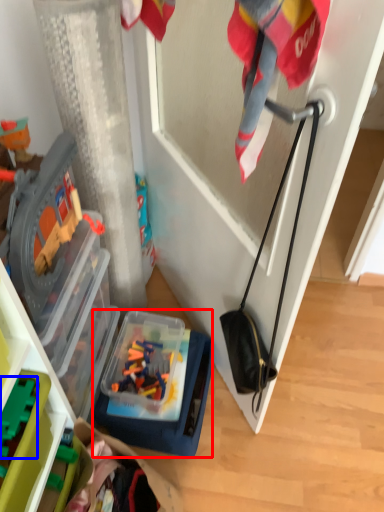
Question: Which point is further to the camera, box (highlighted by a red box) or toy (highlighted by a blue box)?

Choices:
 (A) box
 (B) toy

Answer: (A)